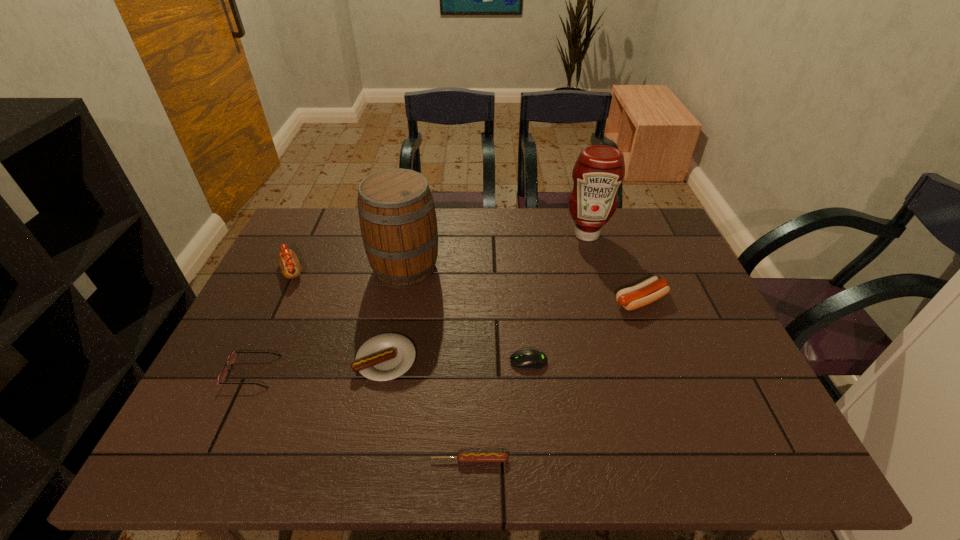
The image size is (960, 540). What are the coordinates of `object that can be found as the sixth closest to the condiment` in the screenshot? It's located at tap(288, 261).

Select which sausage is the third closest to the computer mouse. Please provide its 2D coordinates. Your answer should be formatted as a tuple, i.e. [(x, y)], where the tuple contains the x and y coordinates of a point satisfying the conditions above.

[(651, 289)]

Identify the location of sausage that stands as the closest to the cider. (384, 357).

Identify the location of free point that satisfies the following two spatial constraints: 1. on the back side of the farthest object; 2. on the right side of the cider. The width and height of the screenshot is (960, 540). (412, 234).

Locate an element on the screen. vacant region that satisfies the following two spatial constraints: 1. on the back side of the shortest sausage; 2. on the right side of the second farthest sausage is located at coordinates (472, 301).

The height and width of the screenshot is (540, 960). What are the coordinates of `vacant space that satisfies the following two spatial constraints: 1. on the front side of the second shortest sausage; 2. on the left side of the nearest sausage` in the screenshot? It's located at (367, 460).